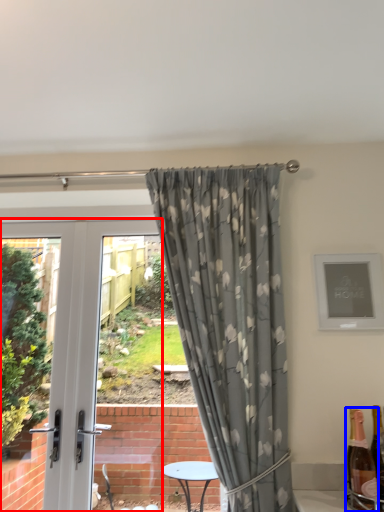
Question: Which point is closer to the camera, door (highlighted by a red box) or bottle (highlighted by a blue box)?

Choices:
 (A) door
 (B) bottle

Answer: (B)